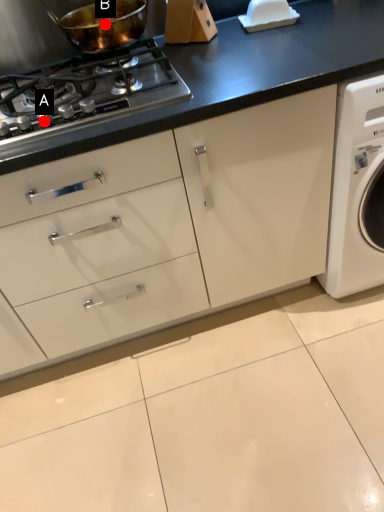
Question: Two points are circled on the image, labeled by A and B beside each circle. Which point is closer to the camera?

Choices:
 (A) A is closer
 (B) B is closer

Answer: (A)